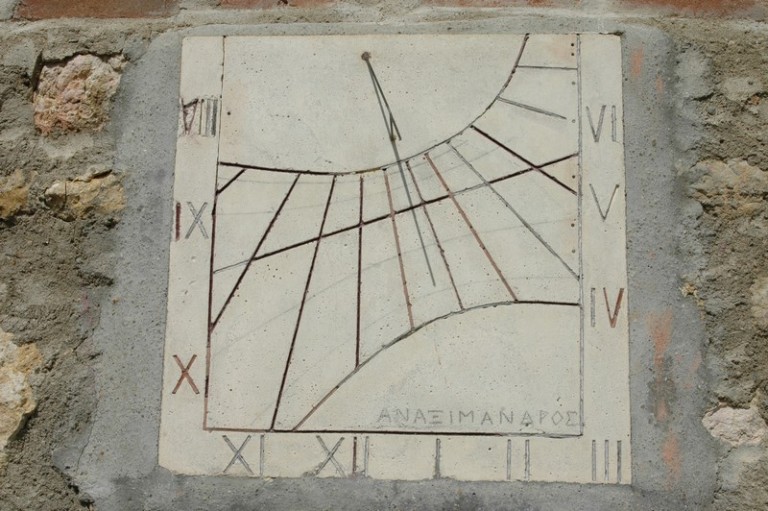
Locate an element on the screen. The width and height of the screenshot is (768, 511). stones on the left side of the floor is located at coordinates (84, 107), (111, 191), (12, 202), (18, 378).